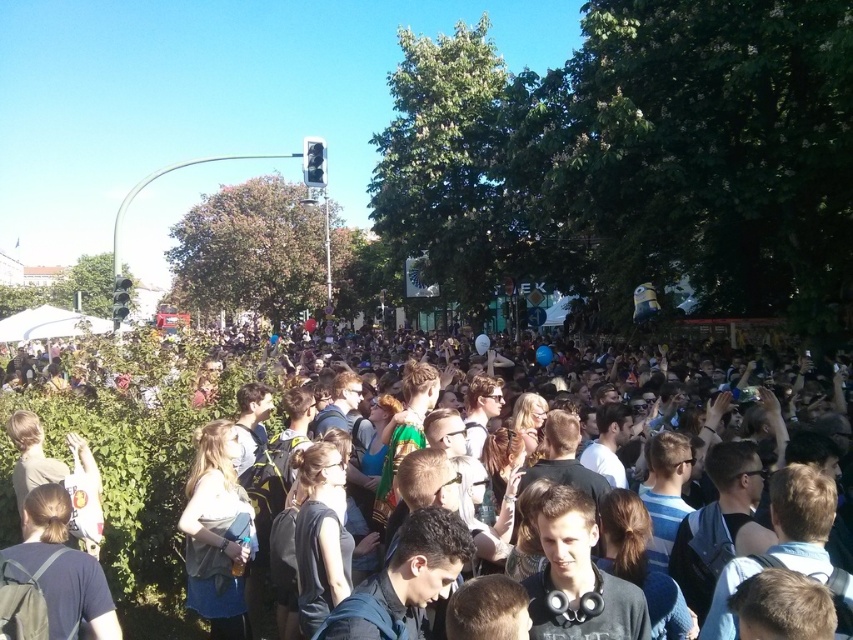
Question: Which object is closer to the camera taking this photo?

Choices:
 (A) dark blue clothing at center
 (B) denim jacket at center

Answer: (A)

Question: Does dark blue clothing at center have a smaller size compared to denim jacket at center?

Choices:
 (A) no
 (B) yes

Answer: (A)

Question: Which point is closer to the camera?

Choices:
 (A) dark blue clothing at center
 (B) denim jacket at center

Answer: (A)

Question: Can you confirm if dark blue clothing at center is wider than denim jacket at center?

Choices:
 (A) no
 (B) yes

Answer: (B)

Question: Is dark blue clothing at center bigger than denim jacket at center?

Choices:
 (A) yes
 (B) no

Answer: (A)